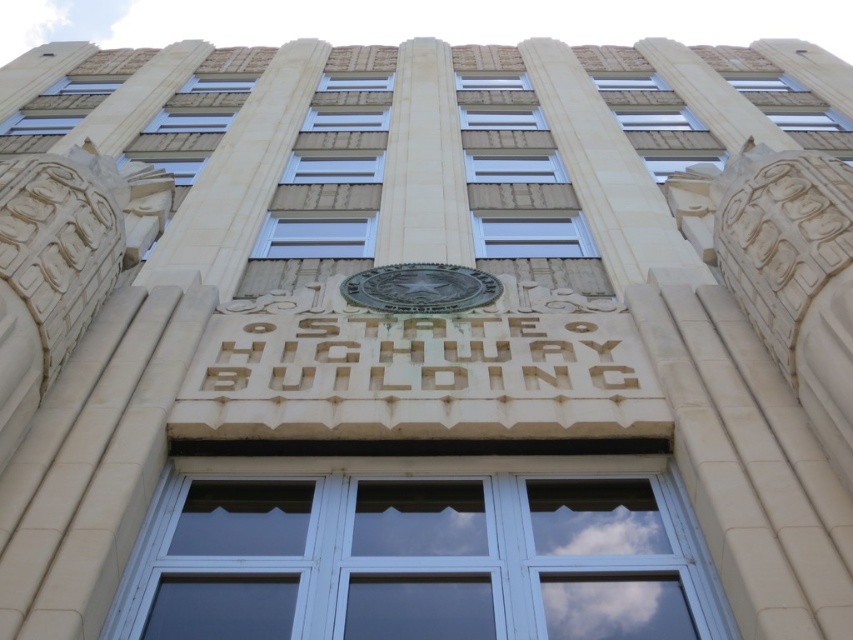
You are standing in front of the State Highway Building and want to take a photo of the white carved stone at center. If your camera has a maximum focus range of 10 meters, will you be able to capture it clearly?

The white carved stone at center is 12.07 meters away from the camera, which exceeds the camera maximum focus range of 10 meters. Therefore, the camera cannot focus on the white carved stone at center clearly.

From the picture: You are an architect examining the facade of the State Highway Building. You notice two central elements on the building facade. Which one is closer to you, the white carved stone at center or the bronze textured seal at center?

The white carved stone at center is closer to you because it is in front of the bronze textured seal at center.

From the picture: You are an architect designing a new addition to the State Highway Building. You need to place a new rectangular plaque exactly 10 cm to the right of the white carved stone at center. Where should you position the plaque in terms of coordinates?

The white carved stone at center is located at coordinates point (422, 355). To place the plaque 10 cm to the right, you would position it at point (422, 419).